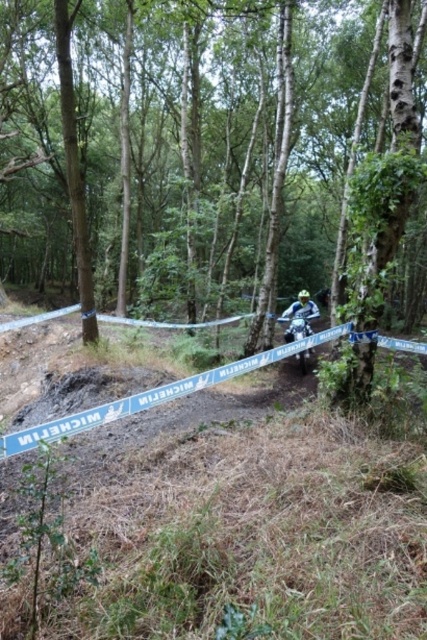
Question: Is brown bark tree at center behind blue metallic motorcycle at center?

Choices:
 (A) no
 (B) yes

Answer: (A)

Question: Is brown bark tree at center below blue metallic motorcycle at center?

Choices:
 (A) yes
 (B) no

Answer: (B)

Question: Which point appears farthest from the camera in this image?

Choices:
 (A) (383, 116)
 (B) (292, 321)

Answer: (A)

Question: Is brown bark tree at center thinner than blue metallic motorcycle at center?

Choices:
 (A) yes
 (B) no

Answer: (B)